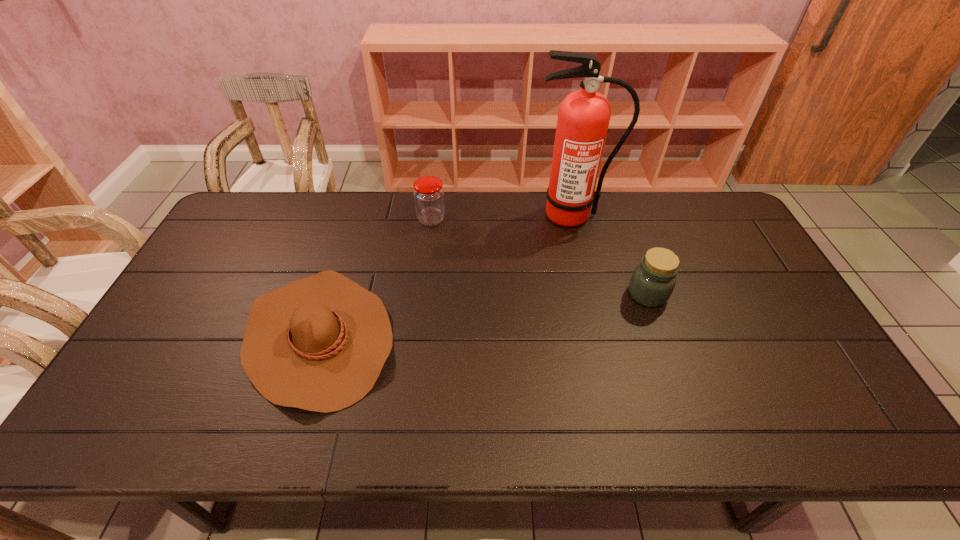
The height and width of the screenshot is (540, 960). In order to click on unoccupied area between the cowboy hat and the tallest object in this screenshot , I will do `click(445, 276)`.

In order to click on vacant space in between the right jar and the tallest object in this screenshot , I will do `click(610, 255)`.

This screenshot has width=960, height=540. Identify the location of vacant area between the fire extinguisher and the left jar. (501, 218).

Find the location of a particular element. vacant space in between the cowboy hat and the tallest object is located at coordinates (445, 276).

This screenshot has height=540, width=960. I want to click on free space between the fire extinguisher and the shortest object, so click(x=445, y=276).

This screenshot has height=540, width=960. Identify the location of blank region between the shortest object and the left jar. (375, 278).

Identify the location of free area in between the fire extinguisher and the right jar. (610, 255).

Find the location of a particular element. Image resolution: width=960 pixels, height=540 pixels. free space between the tallest object and the left jar is located at coordinates (501, 218).

This screenshot has width=960, height=540. Find the location of `free space that is in between the farther jar and the shortest object`. free space that is in between the farther jar and the shortest object is located at coordinates (375, 278).

This screenshot has height=540, width=960. In order to click on object that is the nearest to the cowboy hat in this screenshot , I will do `click(429, 199)`.